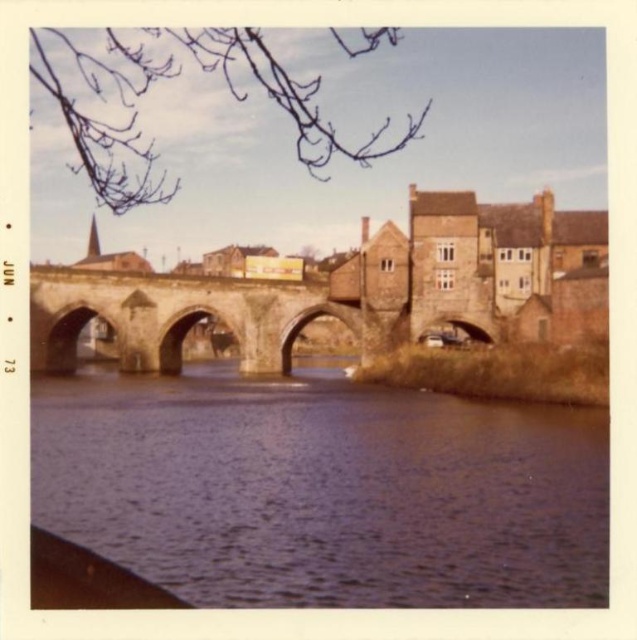
Question: Among these points, which one is nearest to the camera?

Choices:
 (A) (117, 312)
 (B) (531, 484)

Answer: (B)

Question: Which point is farther to the camera?

Choices:
 (A) (155, 285)
 (B) (534, 444)

Answer: (A)

Question: Can you confirm if brown water at center is wider than stone arch bridge at center?

Choices:
 (A) yes
 (B) no

Answer: (A)

Question: Can you confirm if brown water at center is thinner than stone arch bridge at center?

Choices:
 (A) yes
 (B) no

Answer: (B)

Question: Is brown water at center below stone arch bridge at center?

Choices:
 (A) yes
 (B) no

Answer: (A)